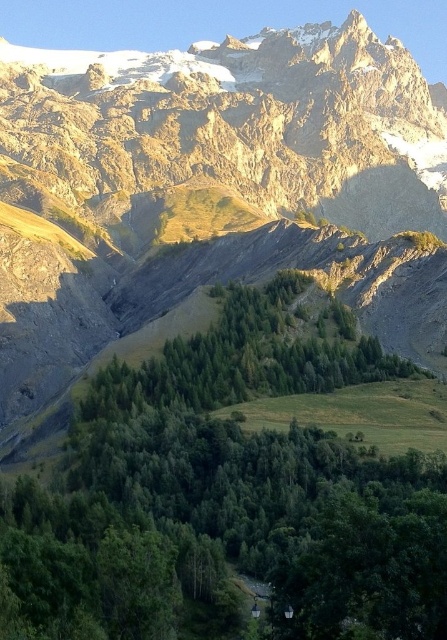
Is rugged stone mountain at upper center shorter than green leafy trees at center?

No, rugged stone mountain at upper center is not shorter than green leafy trees at center.

Can you confirm if rugged stone mountain at upper center is positioned below green leafy trees at center?

Actually, rugged stone mountain at upper center is above green leafy trees at center.

Is point (391, 156) positioned after point (400, 467)?

Yes.

Locate an element on the screen. rugged stone mountain at upper center is located at coordinates (214, 189).